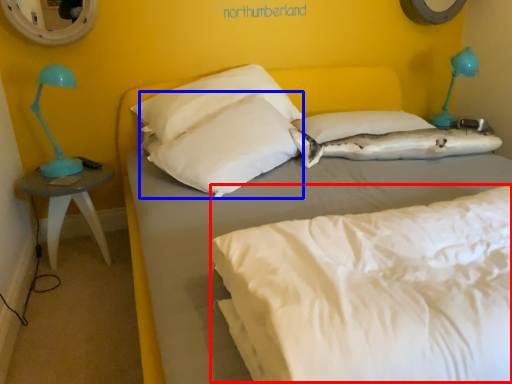
Question: Which of the following is the closest to the observer, mattress (highlighted by a red box) or pillow (highlighted by a blue box)?

Choices:
 (A) mattress
 (B) pillow

Answer: (A)